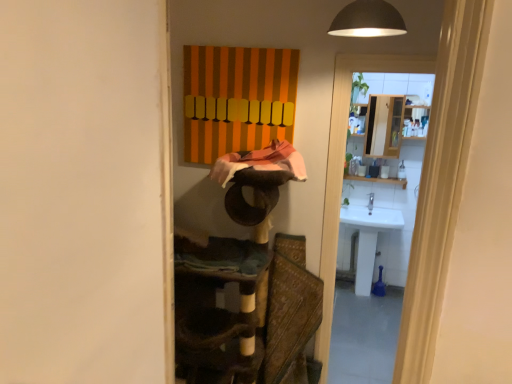
Locate an element on the screen. The width and height of the screenshot is (512, 384). textured brown fabric swivel chair at center is located at coordinates tap(290, 314).

What is the approximate height of white glossy sink at right?

white glossy sink at right is 1.94 meters in height.

The height and width of the screenshot is (384, 512). Find the location of `textured brown fabric swivel chair at center`. textured brown fabric swivel chair at center is located at coordinates (290, 314).

Is textured brown fabric swivel chair at center wider than white glossy sink at right?

Yes.

From the picture: Considering the sizes of objects textured brown fabric swivel chair at center and white glossy sink at right in the image provided, who is bigger, textured brown fabric swivel chair at center or white glossy sink at right?

white glossy sink at right.

Identify the location of screen door above the textured brown fabric swivel chair at center (from a real-world perspective). (342, 170).

Is the position of textured brown fabric swivel chair at center less distant than that of white glossy sink at right?

Yes, textured brown fabric swivel chair at center is closer to the viewer.

Is point (285, 248) positioned behind point (340, 213)?

That is False.

Considering the relative sizes of textured brown fabric swivel chair at center and white glossy sink at right in the image provided, is textured brown fabric swivel chair at center bigger than white glossy sink at right?

Incorrect, textured brown fabric swivel chair at center is not larger than white glossy sink at right.

Is white glossy sink at right a part of textured brown fabric swivel chair at center?

No.

Based on the photo, from the image's perspective, which one is positioned lower, white glossy sink at right or white glossy sink at right?

white glossy sink at right is shown below in the image.

Does white glossy sink at right turn towards white glossy sink at right?

Yes.

Between white glossy sink at right and textured brown fabric swivel chair at center, which one has larger size?

white glossy sink at right.

Is white glossy sink at right looking in the opposite direction of textured brown fabric swivel chair at center?

No, white glossy sink at right is not facing the opposite direction of textured brown fabric swivel chair at center.

Locate an element on the screen. This screenshot has width=512, height=384. screen door behind the textured brown fabric swivel chair at center is located at coordinates coord(342,170).

Is the surface of white glossy sink at right in direct contact with textured brown fabric swivel chair at center?

They are not placed beside each other.

Would you say white glossy sink at right is a long distance from textured brown fabric swivel chair at center?

Yes.

Is white glossy sink at right oriented away from textured brown fabric swivel chair at center?

No.

Which is correct: white glossy sink at right is inside textured brown fabric swivel chair at center, or outside of it?

white glossy sink at right is not enclosed by textured brown fabric swivel chair at center.

From the image's perspective, which one is positioned lower, white glossy sink at right or textured brown fabric swivel chair at center?

textured brown fabric swivel chair at center.

Image resolution: width=512 pixels, height=384 pixels. Find the location of `sink located below the white glossy sink at right (from the image's perspective)`. sink located below the white glossy sink at right (from the image's perspective) is located at coordinates (369, 238).

Do you think white glossy sink at right is within white glossy sink at right, or outside of it?

white glossy sink at right is located beyond the bounds of white glossy sink at right.

Who is shorter, white glossy sink at right or white glossy sink at right?

With less height is white glossy sink at right.

How many degrees apart are the facing directions of white glossy sink at right and white glossy sink at right?

There is a 178-degree angle between the facing directions of white glossy sink at right and white glossy sink at right.

Where is `swivel chair beneath the white glossy sink at right (from a real-world perspective)`? The height and width of the screenshot is (384, 512). swivel chair beneath the white glossy sink at right (from a real-world perspective) is located at coordinates (290, 314).

You are a GUI agent. You are given a task and a screenshot of the screen. Output one action in this format:
    pyautogui.click(x=<x>, y=<y>)
    Task: Click on the swivel chair in front of the white glossy sink at right
    
    Given the screenshot: What is the action you would take?
    pyautogui.click(x=290, y=314)

When comparing their distances from textured brown fabric swivel chair at center, does white glossy sink at right or white glossy sink at right seem further?

white glossy sink at right.

From the image, which object appears to be nearer to white glossy sink at right, textured brown fabric swivel chair at center or white glossy sink at right?

white glossy sink at right.

Estimate the real-world distances between objects in this image. Which object is closer to white glossy sink at right, white glossy sink at right or textured brown fabric swivel chair at center?

white glossy sink at right is positioned closer to the anchor white glossy sink at right.

When comparing their distances from white glossy sink at right, does textured brown fabric swivel chair at center or white glossy sink at right seem closer?

textured brown fabric swivel chair at center is positioned closer to the anchor white glossy sink at right.

Estimate the real-world distances between objects in this image. Which object is further from white glossy sink at right, white glossy sink at right or textured brown fabric swivel chair at center?

Based on the image, white glossy sink at right appears to be further to white glossy sink at right.

Looking at the image, which one is located further to textured brown fabric swivel chair at center, white glossy sink at right or white glossy sink at right?

white glossy sink at right.

At what (x,y) coordinates should I click in order to perform the action: click on screen door between textured brown fabric swivel chair at center and white glossy sink at right in the front-back direction. Please return your answer as a coordinate pair (x, y). The width and height of the screenshot is (512, 384). Looking at the image, I should click on (342, 170).